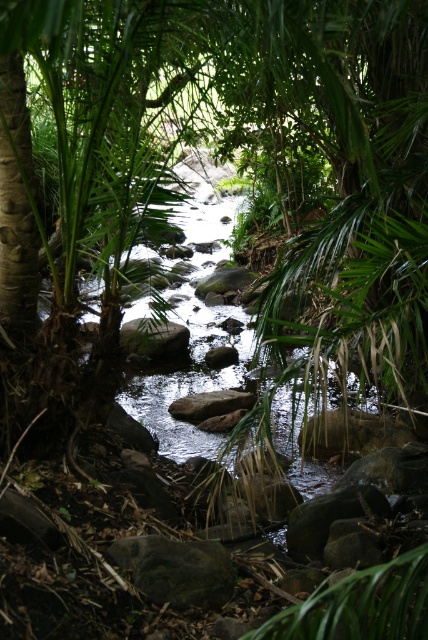
Does dark gray rock at center come in front of gray smooth rock at center?

That is True.

Which is behind, point (163, 545) or point (225, 408)?

The point (225, 408) is more distant.

Where is `dark gray rock at center`? dark gray rock at center is located at coordinates (177, 570).